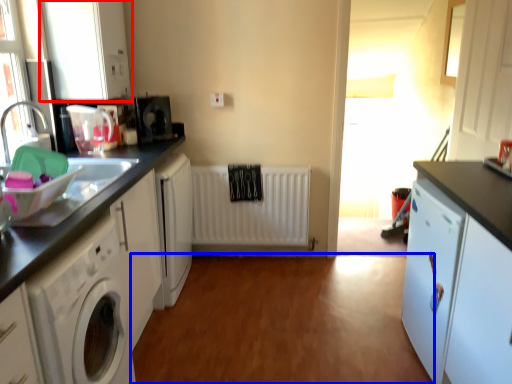
Question: Which object appears closest to the camera in this image, cabinetry (highlighted by a red box) or plain (highlighted by a blue box)?

Choices:
 (A) cabinetry
 (B) plain

Answer: (B)